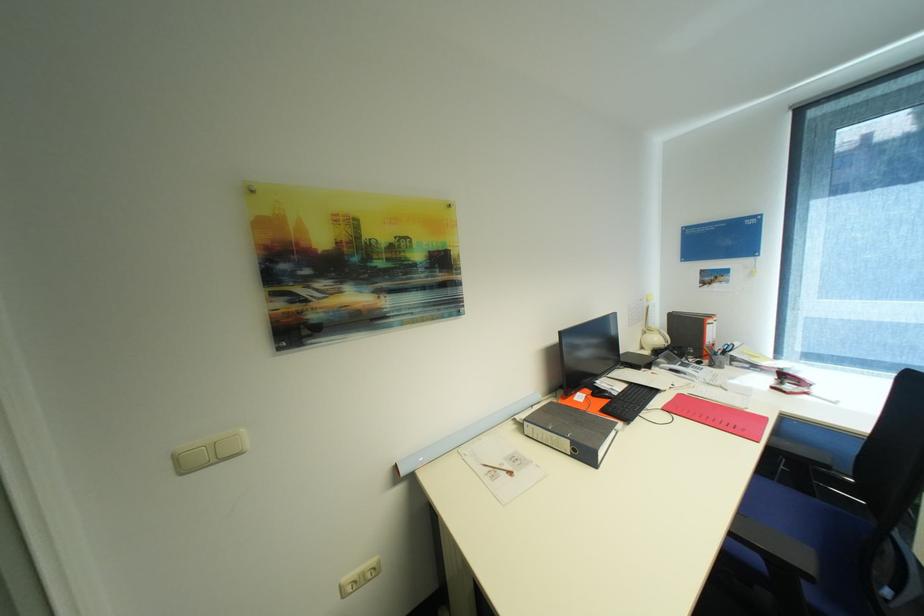
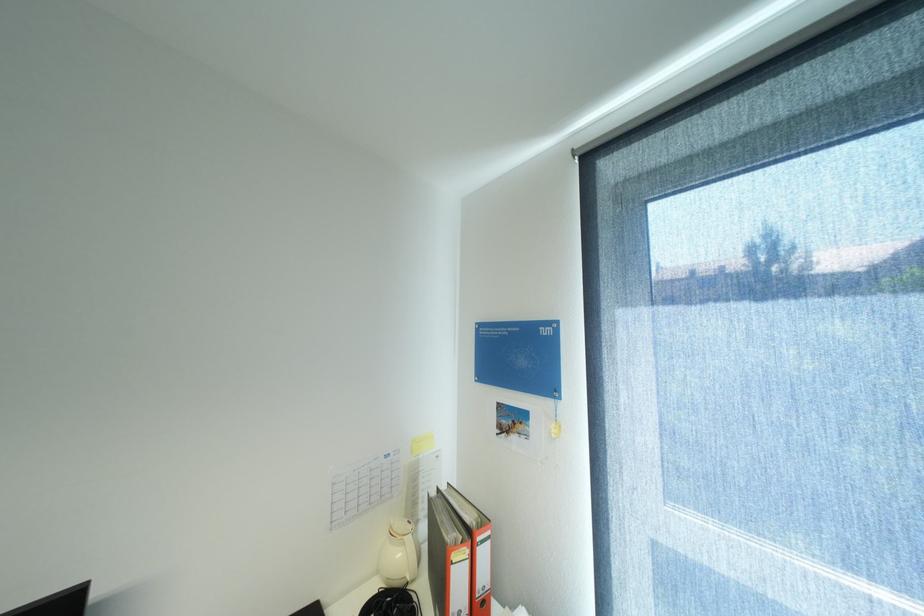
Find the pixel in the second image that matches [663,339] in the first image.

(407, 554)